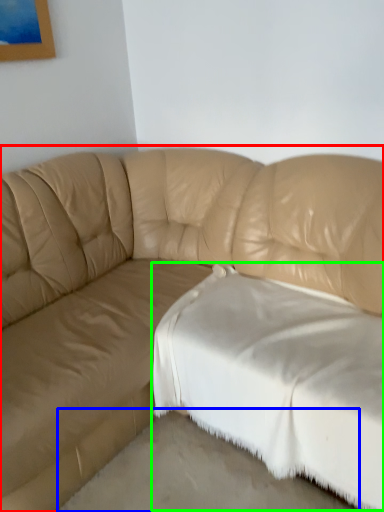
Question: Estimate the real-world distances between objects in this image. Which object is farther from studio couch (highlighted by a red box), concrete (highlighted by a blue box) or sheet (highlighted by a green box)?

Choices:
 (A) concrete
 (B) sheet

Answer: (A)